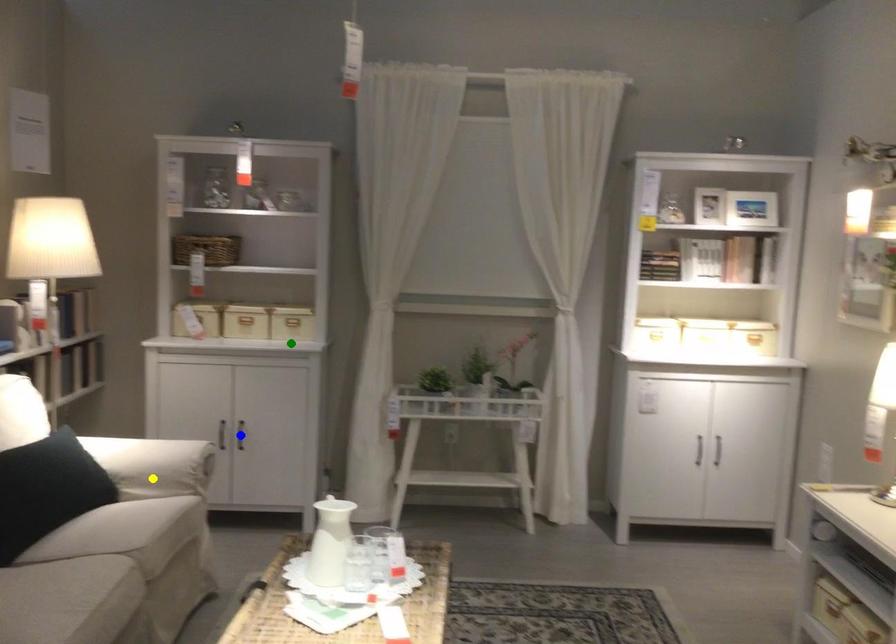
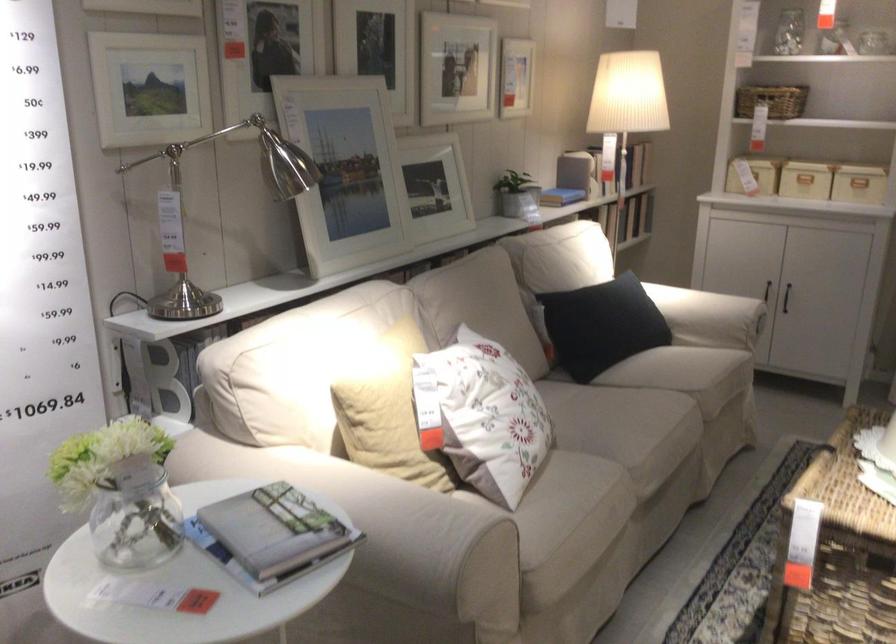
I am providing you with two images of the same scene from different viewpoints. Three points are marked in image1. Which point corresponds to a part or object that is occluded in image2?In image1, three points are marked. Which of them correspond to a part or object that is occluded in image2?Among the three points shown in image1, which one corresponds to a part or object that is no longer visible due to occlusion in image2?

blue point